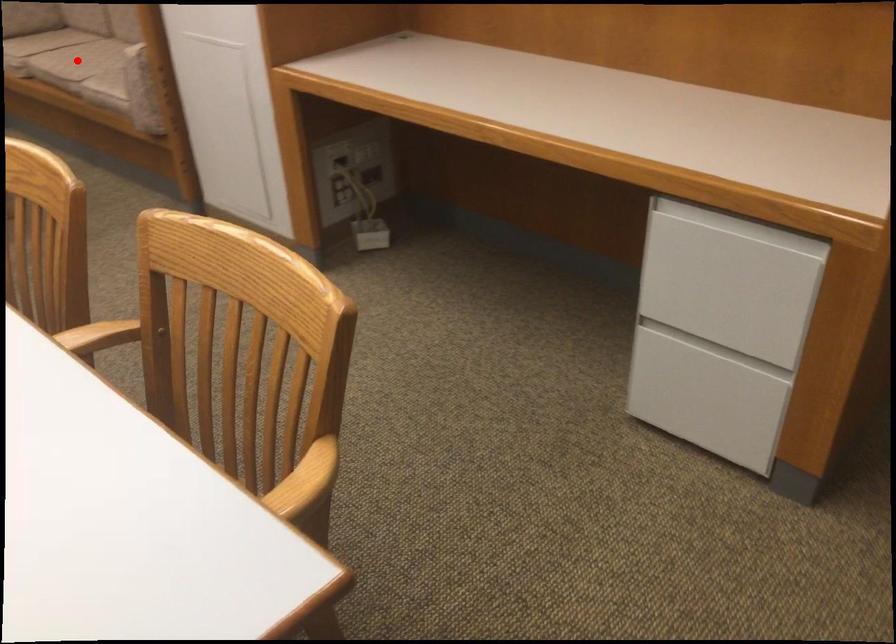
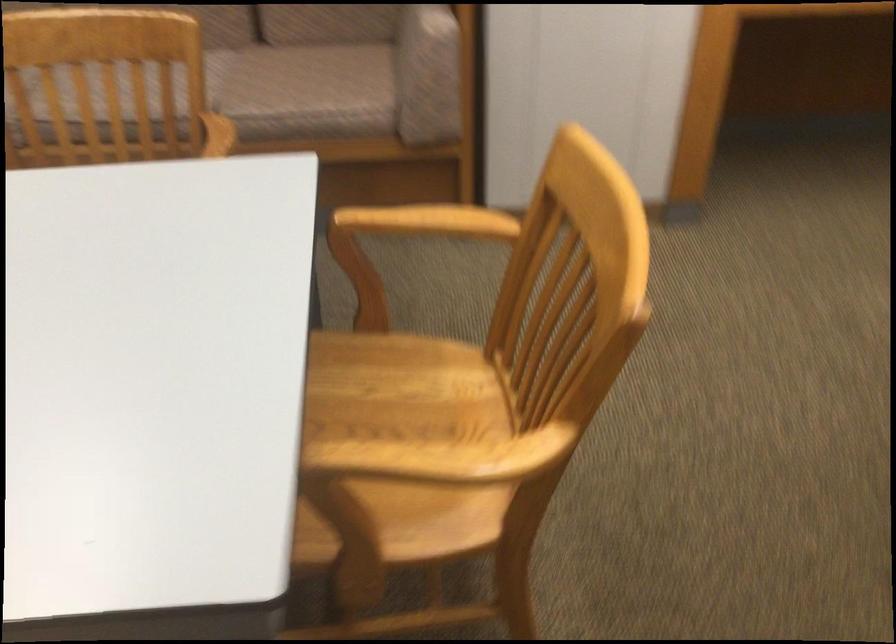
Question: I am providing you with two images of the same scene from different viewpoints. A red point is marked on the first image. Is the red point's position out of view in image 2?

Choices:
 (A) Yes
 (B) No

Answer: (A)